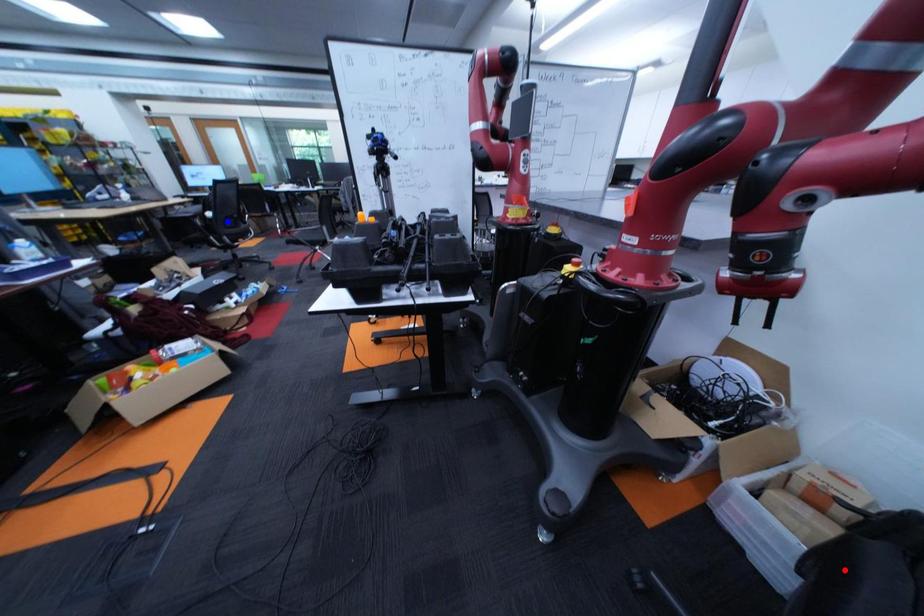
Question: Two points are marked on the image. Which point is closer to the camera?

Choices:
 (A) Blue point is closer.
 (B) Red point is closer.

Answer: (B)